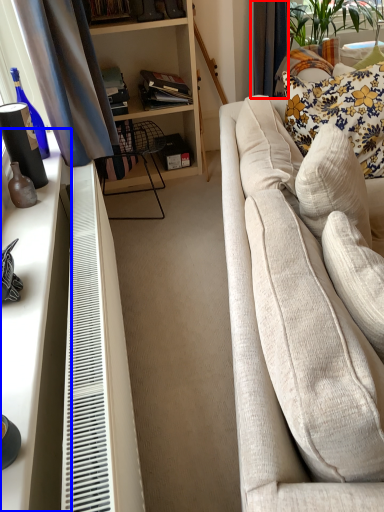
Question: Which of the following is the closest to the observer, curtain (highlighted by a red box) or desk (highlighted by a blue box)?

Choices:
 (A) curtain
 (B) desk

Answer: (B)